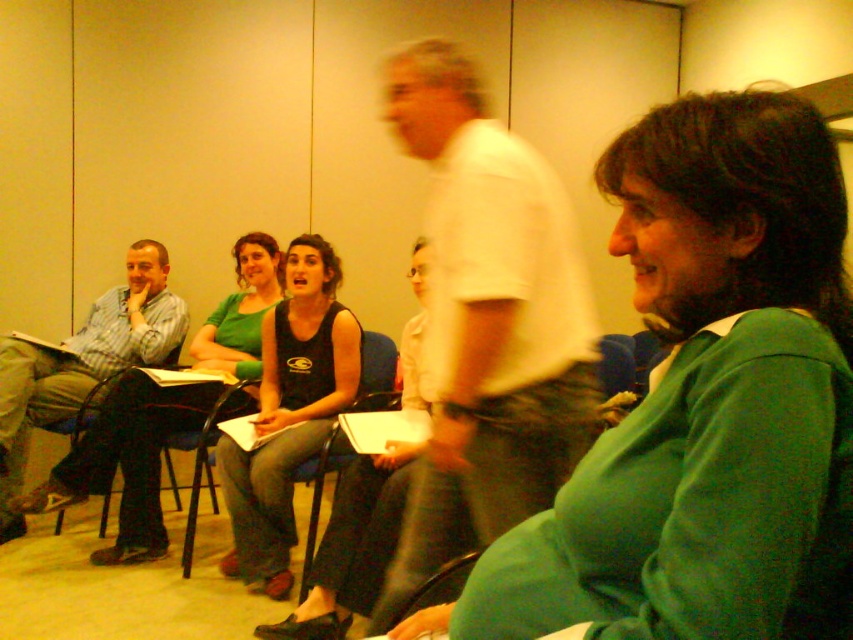
Based on the photo, you are standing in the room and notice the white matte shirt at center and the black fabric chair at center. Which object is taller?

The white matte shirt at center is much taller than the black fabric chair at center.

You are a photographer trying to capture a group photo of the people in the classroom. You notice the green matte sweater at center and the black tank top at center. Which person should you ask to stand on a small stool so that their head is visible in the photo?

The green matte sweater at center is shorter than the black tank top at center, so the photographer should ask the green matte sweater at center to stand on a small stool to make their head visible.

You are a photographer setting up a shoot in the classroom. You need to ensure that the white matte shirt at center is visible above the black fabric chair at center. Based on the scene description, is this arrangement already achieved?

Yes, the white matte shirt at center is already positioned above the black fabric chair at center as described.